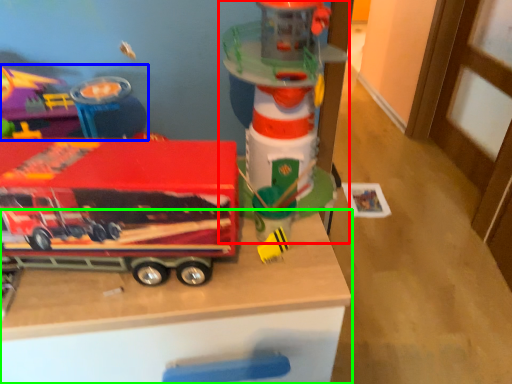
Question: Which object is the closest to the toy (highlighted by a red box)? Choose among these: toy (highlighted by a blue box) or table (highlighted by a green box).

Choices:
 (A) toy
 (B) table

Answer: (B)